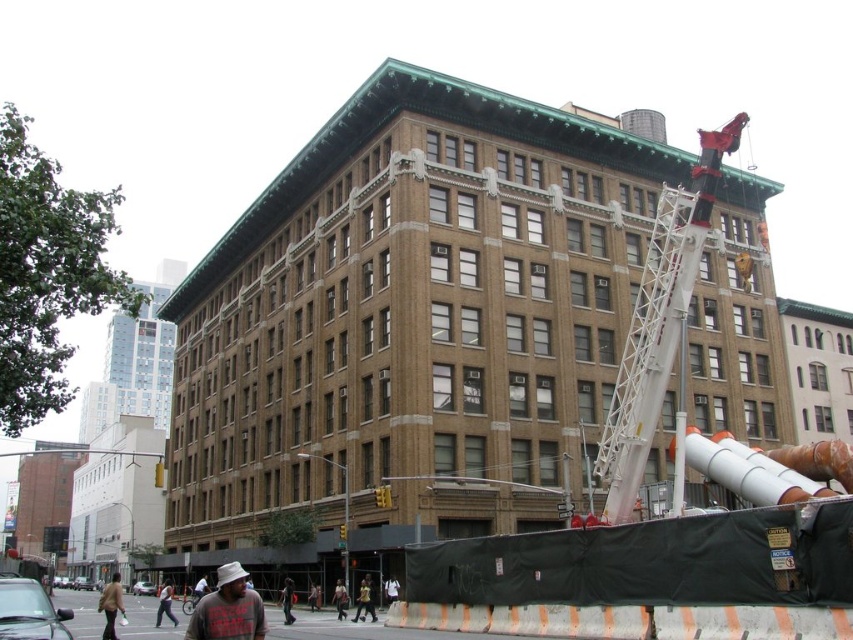
Which is behind, point (701, 221) or point (113, 576)?

Point (113, 576)

Locate an element on the screen. The width and height of the screenshot is (853, 640). white metallic crane at right is located at coordinates (659, 321).

Which of these two, white metallic crane at right or gray cotton hat at lower left, stands taller?

white metallic crane at right is taller.

From the picture: Is white metallic crane at right smaller than gray cotton hat at lower left?

Incorrect, white metallic crane at right is not smaller in size than gray cotton hat at lower left.

Between point (659, 408) and point (213, 634), which one is positioned in front?

Point (213, 634) is in front.

Identify the location of white metallic crane at right. Image resolution: width=853 pixels, height=640 pixels. (659, 321).

From the picture: Who is positioned more to the left, brown brick building at center or white metallic crane at right?

From the viewer's perspective, brown brick building at center appears more on the left side.

Is brown brick building at center positioned at the back of white metallic crane at right?

That is True.

Is point (585, 428) positioned after point (662, 260)?

Yes, point (585, 428) is behind point (662, 260).

Locate an element on the screen. This screenshot has width=853, height=640. brown brick building at center is located at coordinates (407, 324).